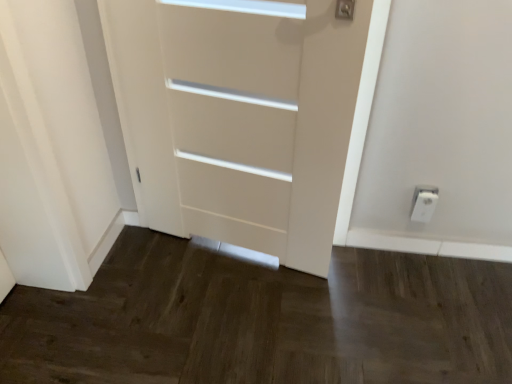
Locate an element on the screen. This screenshot has width=512, height=384. white plastic electric outlet at lower right is located at coordinates (423, 203).

What do you see at coordinates (423, 203) in the screenshot? The width and height of the screenshot is (512, 384). I see `white plastic electric outlet at lower right` at bounding box center [423, 203].

Measure the distance between white matte door at center and camera.

white matte door at center and camera are 3.71 feet apart from each other.

The width and height of the screenshot is (512, 384). What do you see at coordinates (239, 124) in the screenshot?
I see `white matte door at center` at bounding box center [239, 124].

Find the location of `white matte door at center`. white matte door at center is located at coordinates (239, 124).

Where is `white plastic electric outlet at lower right`? This screenshot has width=512, height=384. white plastic electric outlet at lower right is located at coordinates (x=423, y=203).

Which object is positioned more to the left, white matte door at center or white plastic electric outlet at lower right?

From the viewer's perspective, white matte door at center appears more on the left side.

Which object is closer to the camera taking this photo, white matte door at center or white plastic electric outlet at lower right?

white matte door at center is in front.

Is point (258, 79) positioned after point (424, 186)?

That is False.

From the image's perspective, relative to white plastic electric outlet at lower right, is white matte door at center above or below?

Clearly, from the image's perspective, white matte door at center is above white plastic electric outlet at lower right.

From a real-world perspective, does white matte door at center stand above white plastic electric outlet at lower right?

Yes.

Considering the sizes of objects white matte door at center and white plastic electric outlet at lower right in the image provided, who is thinner, white matte door at center or white plastic electric outlet at lower right?

white plastic electric outlet at lower right.

Is white matte door at center taller than white plastic electric outlet at lower right?

Yes, white matte door at center is taller than white plastic electric outlet at lower right.

Which of these two, white matte door at center or white plastic electric outlet at lower right, is bigger?

With larger size is white matte door at center.

Is white plastic electric outlet at lower right inside white matte door at center?

No, white plastic electric outlet at lower right is not a part of white matte door at center.

Are white matte door at center and white plastic electric outlet at lower right far apart?

No.

Based on the photo, is white matte door at center aimed at white plastic electric outlet at lower right?

No.

What's the angular difference between white matte door at center and white plastic electric outlet at lower right's facing directions?

There is a 23.5-degree angle between the facing directions of white matte door at center and white plastic electric outlet at lower right.

How far apart are white matte door at center and white plastic electric outlet at lower right?

The distance of white matte door at center from white plastic electric outlet at lower right is 31.31 inches.

In the image, there is a white matte door at center. Find the location of `electric outlet below it (from a real-world perspective)`. electric outlet below it (from a real-world perspective) is located at coordinates (423, 203).

In the image, is white plastic electric outlet at lower right on the left side or the right side of white matte door at center?

white plastic electric outlet at lower right is positioned on white matte door at center's right side.

Considering the positions of objects white plastic electric outlet at lower right and white matte door at center in the image provided, who is in front, white plastic electric outlet at lower right or white matte door at center?

Positioned in front is white matte door at center.

Is point (423, 208) closer to viewer compared to point (174, 233)?

Yes.

From the image's perspective, would you say white plastic electric outlet at lower right is shown under white matte door at center?

Yes, from the image's perspective, white plastic electric outlet at lower right is below white matte door at center.

From a real-world perspective, is white plastic electric outlet at lower right positioned over white matte door at center based on gravity?

No, from a real-world perspective, white plastic electric outlet at lower right is not over white matte door at center

In terms of width, does white plastic electric outlet at lower right look wider or thinner when compared to white matte door at center?

In the image, white plastic electric outlet at lower right appears to be more narrow than white matte door at center.

Considering the sizes of objects white plastic electric outlet at lower right and white matte door at center in the image provided, who is shorter, white plastic electric outlet at lower right or white matte door at center?

With less height is white plastic electric outlet at lower right.

Between white plastic electric outlet at lower right and white matte door at center, which one has larger size?

white matte door at center.

Is white plastic electric outlet at lower right spatially inside white matte door at center, or outside of it?

white plastic electric outlet at lower right cannot be found inside white matte door at center.

From the picture: Would you consider white plastic electric outlet at lower right to be distant from white matte door at center?

No, white plastic electric outlet at lower right is not far away from white matte door at center.

Looking at this image, is white plastic electric outlet at lower right facing towards white matte door at center?

No, white plastic electric outlet at lower right is not oriented towards white matte door at center.

How many degrees apart are the facing directions of white plastic electric outlet at lower right and white matte door at center?

23.5 degrees separate the facing orientations of white plastic electric outlet at lower right and white matte door at center.

The width and height of the screenshot is (512, 384). Identify the location of electric outlet located behind the white matte door at center. (423, 203).

The width and height of the screenshot is (512, 384). I want to click on door above the white plastic electric outlet at lower right (from the image's perspective), so click(239, 124).

Where is `door that appears on the left of white plastic electric outlet at lower right`? door that appears on the left of white plastic electric outlet at lower right is located at coordinates (239, 124).